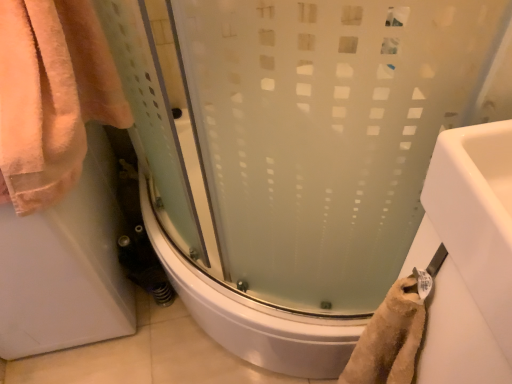
Question: Should I look upward or downward to see frosted glass shower door at center?

Choices:
 (A) up
 (B) down

Answer: (B)

Question: Is frosted glass shower door at center at the left side of pink terry cloth towel at left?

Choices:
 (A) yes
 (B) no

Answer: (B)

Question: Is pink terry cloth towel at left a part of frosted glass shower door at center?

Choices:
 (A) yes
 (B) no

Answer: (B)

Question: Can you confirm if frosted glass shower door at center is thinner than pink terry cloth towel at left?

Choices:
 (A) yes
 (B) no

Answer: (B)

Question: Could you tell me if frosted glass shower door at center is turned towards pink terry cloth towel at left?

Choices:
 (A) no
 (B) yes

Answer: (B)

Question: From the image's perspective, is frosted glass shower door at center over pink terry cloth towel at left?

Choices:
 (A) yes
 (B) no

Answer: (B)

Question: Considering the relative positions of frosted glass shower door at center and pink terry cloth towel at left in the image provided, is frosted glass shower door at center in front of pink terry cloth towel at left?

Choices:
 (A) yes
 (B) no

Answer: (B)

Question: Is pink terry cloth towel at left taller than frosted glass shower door at center?

Choices:
 (A) yes
 (B) no

Answer: (A)

Question: Is pink terry cloth towel at left closer to camera compared to frosted glass shower door at center?

Choices:
 (A) yes
 (B) no

Answer: (A)

Question: Considering the relative positions of pink terry cloth towel at left and frosted glass shower door at center in the image provided, is pink terry cloth towel at left to the left of frosted glass shower door at center from the viewer's perspective?

Choices:
 (A) no
 (B) yes

Answer: (B)

Question: From the image's perspective, is pink terry cloth towel at left on top of frosted glass shower door at center?

Choices:
 (A) yes
 (B) no

Answer: (A)

Question: Is pink terry cloth towel at left positioned with its back to frosted glass shower door at center?

Choices:
 (A) no
 (B) yes

Answer: (A)

Question: From a real-world perspective, is pink terry cloth towel at left positioned over frosted glass shower door at center based on gravity?

Choices:
 (A) yes
 (B) no

Answer: (A)

Question: Do you think pink terry cloth towel at left is within frosted glass shower door at center, or outside of it?

Choices:
 (A) outside
 (B) inside

Answer: (A)